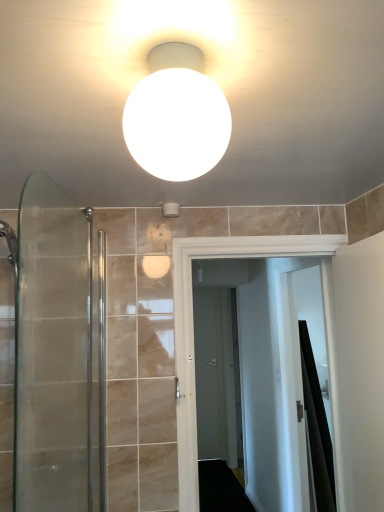
Question: Is matte gray door at center closer to the viewer compared to white matte toilet paper holder at upper center?

Choices:
 (A) no
 (B) yes

Answer: (A)

Question: Would you say white matte toilet paper holder at upper center is part of matte gray door at center's contents?

Choices:
 (A) yes
 (B) no

Answer: (B)

Question: From a real-world perspective, is matte gray door at center positioned under white matte toilet paper holder at upper center based on gravity?

Choices:
 (A) yes
 (B) no

Answer: (A)

Question: Could you tell me if matte gray door at center is turned towards white matte toilet paper holder at upper center?

Choices:
 (A) yes
 (B) no

Answer: (B)

Question: Is matte gray door at center to the left of white matte toilet paper holder at upper center from the viewer's perspective?

Choices:
 (A) no
 (B) yes

Answer: (A)

Question: From a real-world perspective, is matte gray door at center located higher than white matte toilet paper holder at upper center?

Choices:
 (A) yes
 (B) no

Answer: (B)

Question: From a real-world perspective, is white matte toilet paper holder at upper center on white glossy door at center?

Choices:
 (A) yes
 (B) no

Answer: (A)

Question: Does white matte toilet paper holder at upper center appear on the left side of white glossy door at center?

Choices:
 (A) no
 (B) yes

Answer: (B)

Question: Is white matte toilet paper holder at upper center not within white glossy door at center?

Choices:
 (A) no
 (B) yes

Answer: (B)

Question: Is white matte toilet paper holder at upper center aimed at white glossy door at center?

Choices:
 (A) yes
 (B) no

Answer: (B)

Question: Considering the relative positions of white matte toilet paper holder at upper center and white glossy door at center in the image provided, is white matte toilet paper holder at upper center to the right of white glossy door at center from the viewer's perspective?

Choices:
 (A) yes
 (B) no

Answer: (B)

Question: Considering the relative sizes of white matte toilet paper holder at upper center and white glossy door at center in the image provided, is white matte toilet paper holder at upper center thinner than white glossy door at center?

Choices:
 (A) no
 (B) yes

Answer: (B)

Question: Is white matte sphere at upper center taller than white matte toilet paper holder at upper center?

Choices:
 (A) yes
 (B) no

Answer: (A)